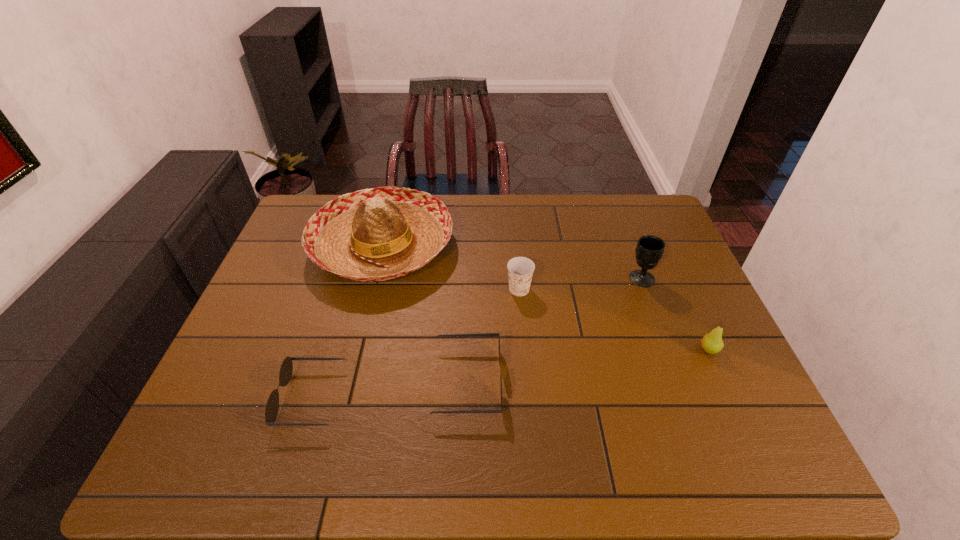
Identify the location of the left sunglasses. (286, 370).

This screenshot has height=540, width=960. What are the coordinates of `the shorter sunglasses` in the screenshot? It's located at tap(286, 370).

At what (x,y) coordinates should I click in order to perform the action: click on the taller sunglasses. Please return your answer as a coordinate pair (x, y). Looking at the image, I should click on (483, 334).

In order to click on sombrero in this screenshot , I will do `click(370, 235)`.

Identify the location of the second object from right to left. (649, 250).

Locate an element on the screen. the fifth shortest object is located at coordinates (649, 250).

Identify the location of the rightmost object. Image resolution: width=960 pixels, height=540 pixels. (712, 343).

Where is `Dixie cup`? The image size is (960, 540). Dixie cup is located at coordinates (520, 269).

Locate an element on the screen. vacant region located 0.100m on the front-facing side of the shorter sunglasses is located at coordinates (241, 398).

Locate an element on the screen. Image resolution: width=960 pixels, height=540 pixels. free space located on the front-facing side of the shorter sunglasses is located at coordinates (241, 398).